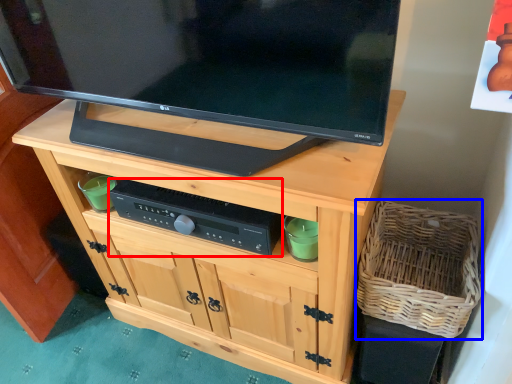
Question: Which of the following is the farthest to the observer, control (highlighted by a red box) or basket (highlighted by a blue box)?

Choices:
 (A) control
 (B) basket

Answer: (A)